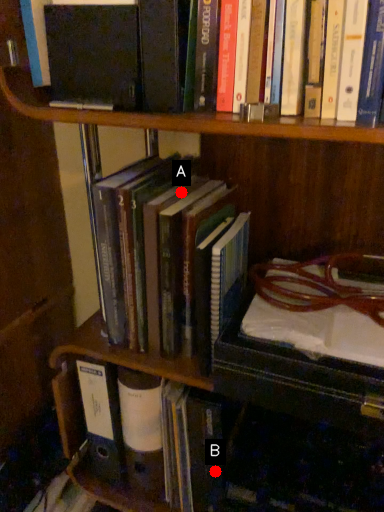
Question: Two points are circled on the image, labeled by A and B beside each circle. Which point appears closest to the camera in this image?

Choices:
 (A) A is closer
 (B) B is closer

Answer: (A)